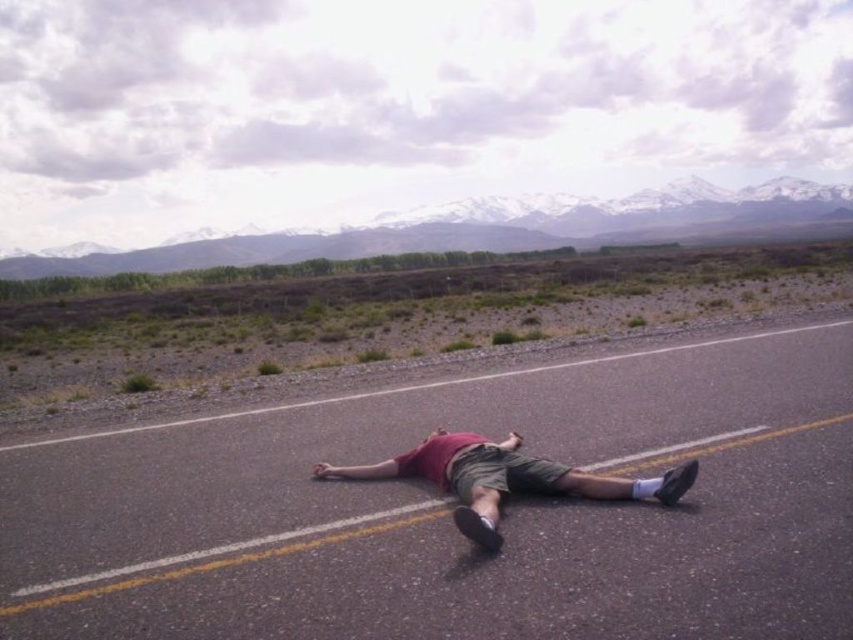
Does black asphalt highway at center have a greater height compared to matte red shirt at center?

Correct, black asphalt highway at center is much taller as matte red shirt at center.

Is black asphalt highway at center below matte red shirt at center?

Indeed, black asphalt highway at center is positioned under matte red shirt at center.

This screenshot has height=640, width=853. What do you see at coordinates (447, 513) in the screenshot? I see `black asphalt highway at center` at bounding box center [447, 513].

Identify the location of black asphalt highway at center. The image size is (853, 640). (447, 513).